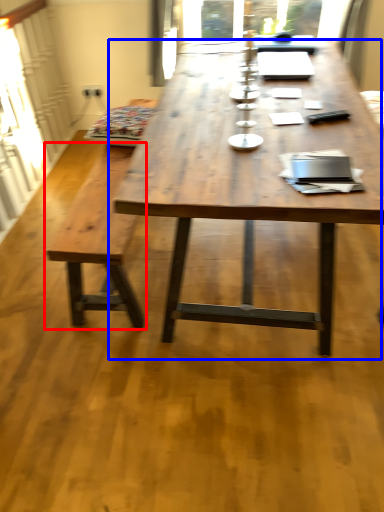
Question: Which of the following is the farthest to the observer, bench (highlighted by a red box) or coffee table (highlighted by a blue box)?

Choices:
 (A) bench
 (B) coffee table

Answer: (A)